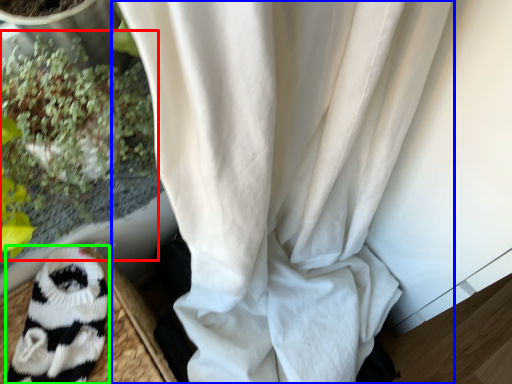
Question: Based on their relative distances, which object is farther from floral arrangement (highlighted by a red box)? Choose from curtain (highlighted by a blue box) and animal (highlighted by a green box).

Choices:
 (A) curtain
 (B) animal

Answer: (A)